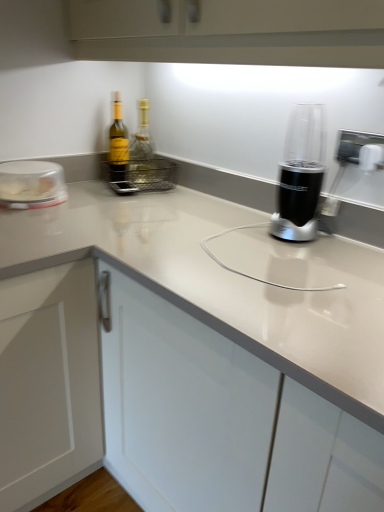
Question: From the image's perspective, is translucent glass bottle at center, which appears as the 2th bottle when viewed from the left, positioned above or below white glossy countertop at center?

Choices:
 (A) below
 (B) above

Answer: (B)

Question: In terms of height, does translucent glass bottle at center, which appears as the 2th bottle when viewed from the left, look taller or shorter compared to white glossy countertop at center?

Choices:
 (A) tall
 (B) short

Answer: (B)

Question: Estimate the real-world distances between objects in this image. Which object is closer to the green glass bottle at upper left, which is the second bottle from right to left?

Choices:
 (A) clear plastic container at left
 (B) white glossy countertop at center
 (C) translucent glass bottle at center, which appears as the 2th bottle when viewed from the left
 (D) black plastic blender at center

Answer: (C)

Question: Which object is the farthest from the black plastic blender at center?

Choices:
 (A) translucent glass bottle at center, the first bottle positioned from the right
 (B) white glossy countertop at center
 (C) green glass bottle at upper left, acting as the 1th bottle starting from the left
 (D) clear plastic container at left

Answer: (D)